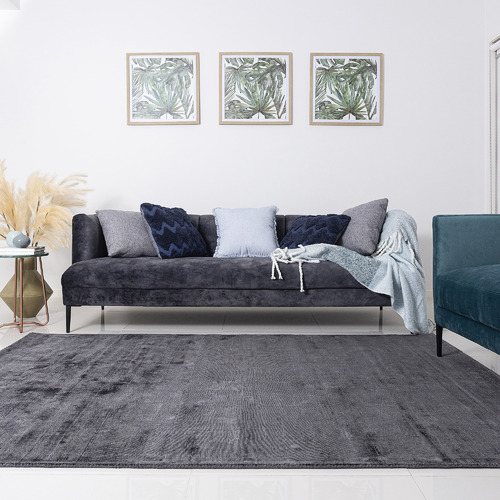
I want to click on decor, so click(19, 235).